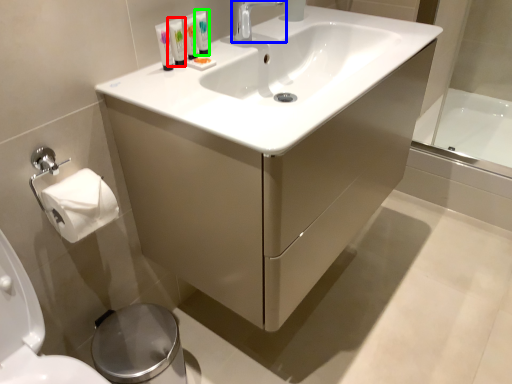
Question: Estimate the real-world distances between objects in this image. Which object is farther from mouthwash (highlighted by a red box), tap (highlighted by a blue box) or mouthwash (highlighted by a green box)?

Choices:
 (A) tap
 (B) mouthwash

Answer: (A)